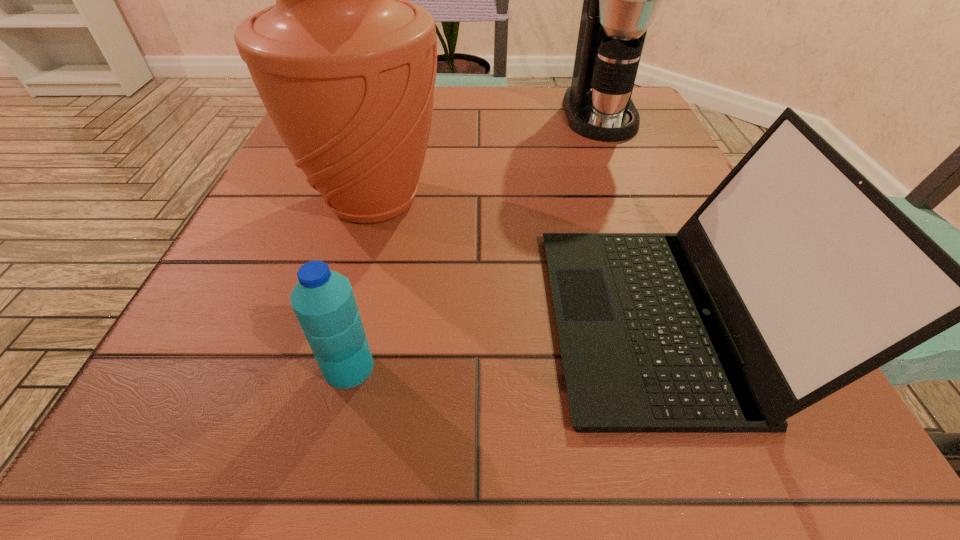
This screenshot has height=540, width=960. What are the coordinates of `object at the far edge` in the screenshot? It's located at (620, 0).

Find the location of a particular element. This screenshot has width=960, height=540. object present at the near edge is located at coordinates (796, 277).

Find the location of a particular element. The height and width of the screenshot is (540, 960). object that is at the left edge is located at coordinates (346, 67).

The width and height of the screenshot is (960, 540). I want to click on coffee maker present at the right edge, so click(620, 0).

This screenshot has height=540, width=960. What are the coordinates of `laptop positioned at the right edge` in the screenshot? It's located at (796, 277).

Find the location of a particular element. Image resolution: width=960 pixels, height=540 pixels. object present at the far right corner is located at coordinates (620, 0).

This screenshot has width=960, height=540. In order to click on object located at the near right corner in this screenshot , I will do `click(796, 277)`.

In order to click on free space at the far edge of the desktop in this screenshot , I will do `click(442, 121)`.

This screenshot has width=960, height=540. What are the coordinates of `vacant space at the near edge` in the screenshot? It's located at (429, 485).

In the image, there is a desktop. Where is `vacant space at the left edge`? Image resolution: width=960 pixels, height=540 pixels. vacant space at the left edge is located at coordinates (262, 327).